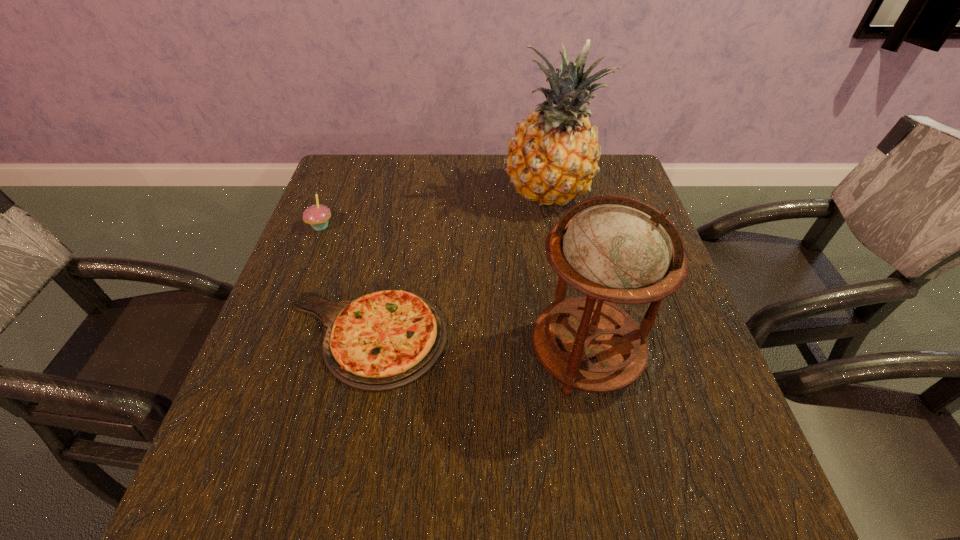
At what (x,y) coordinates should I click in order to perform the action: click on free area in between the pineapple and the pizza. Please return your answer as a coordinate pair (x, y). This screenshot has width=960, height=540. Looking at the image, I should click on (456, 266).

Identify the location of vacant point located between the pineapple and the pizza. (456, 266).

Locate an element on the screen. Image resolution: width=960 pixels, height=540 pixels. free space between the second shortest object and the globe is located at coordinates (453, 291).

Image resolution: width=960 pixels, height=540 pixels. In order to click on vacant point located between the shortest object and the pineapple in this screenshot , I will do `click(456, 266)`.

I want to click on free space between the globe and the shortest object, so tap(474, 346).

You are a GUI agent. You are given a task and a screenshot of the screen. Output one action in this format:
    pyautogui.click(x=<x>, y=<y>)
    Task: Click on the unoccupied area between the pizza and the third tallest object
    This screenshot has height=540, width=960.
    Given the screenshot: What is the action you would take?
    pyautogui.click(x=343, y=282)

Find the location of a particular element. This screenshot has height=540, width=960. vacant area that lies between the cupcake and the shortest object is located at coordinates (343, 282).

You are a GUI agent. You are given a task and a screenshot of the screen. Output one action in this format:
    pyautogui.click(x=<x>, y=<y>)
    Task: Click on the empty space that is in between the globe and the cupcake
    
    Given the screenshot: What is the action you would take?
    pyautogui.click(x=453, y=291)

Choose which object is the third nearest neighbor to the cupcake. Please provide its 2D coordinates. Your answer should be formatted as a tuple, i.e. [(x, y)], where the tuple contains the x and y coordinates of a point satisfying the conditions above.

[(616, 249)]

Find the location of a particular element. The image size is (960, 540). the second closest object to the pizza is located at coordinates (317, 216).